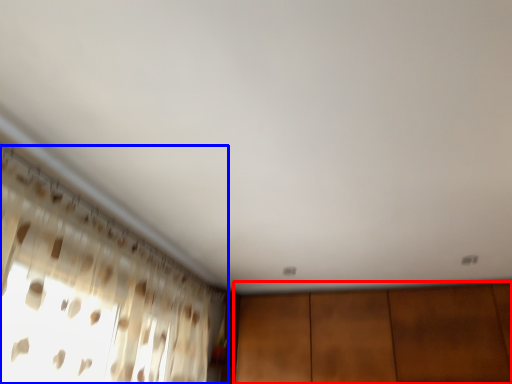
Question: Among these objects, which one is nearest to the camera, dresser (highlighted by a red box) or curtain (highlighted by a blue box)?

Choices:
 (A) dresser
 (B) curtain

Answer: (B)